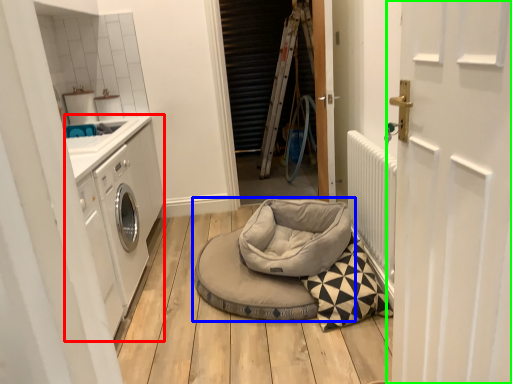
Question: Considering the real-world distances, which object is farthest from washing machine (highlighted by a red box)? dog bed (highlighted by a blue box) or door (highlighted by a green box)?

Choices:
 (A) dog bed
 (B) door

Answer: (B)